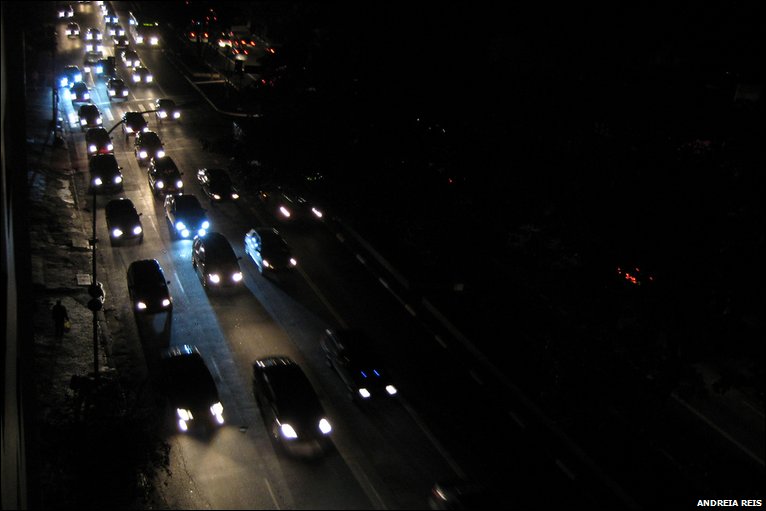
You are a GUI agent. You are given a task and a screenshot of the screen. Output one action in this format:
    pyautogui.click(x=<x>, y=<y>)
    Task: Click on the clock
    This screenshot has height=511, width=766.
    Given the screenshot: What is the action you would take?
    pyautogui.click(x=630, y=278)